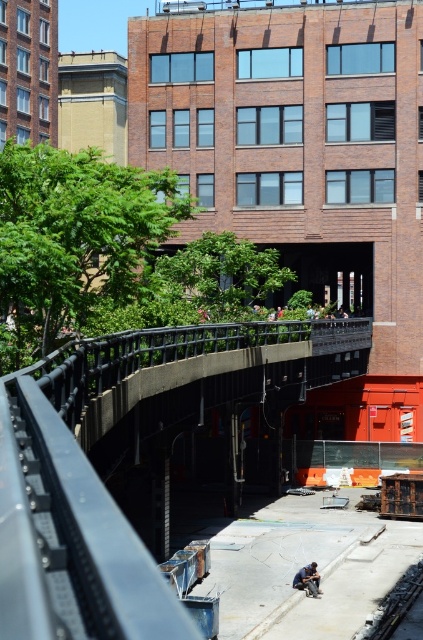
Question: Does concrete sidewalk at center appear on the right side of blue jeans construction worker at lower center?

Choices:
 (A) no
 (B) yes

Answer: (A)

Question: Observing the image, what is the correct spatial positioning of concrete sidewalk at center in reference to blue jeans construction worker at lower center?

Choices:
 (A) below
 (B) above

Answer: (B)

Question: Does concrete sidewalk at center have a larger size compared to blue jeans construction worker at lower center?

Choices:
 (A) yes
 (B) no

Answer: (A)